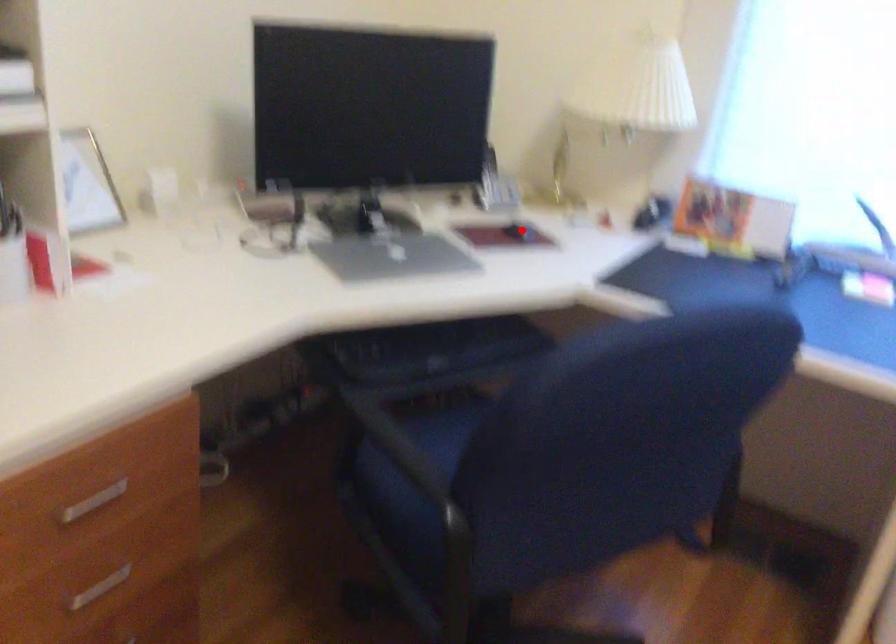
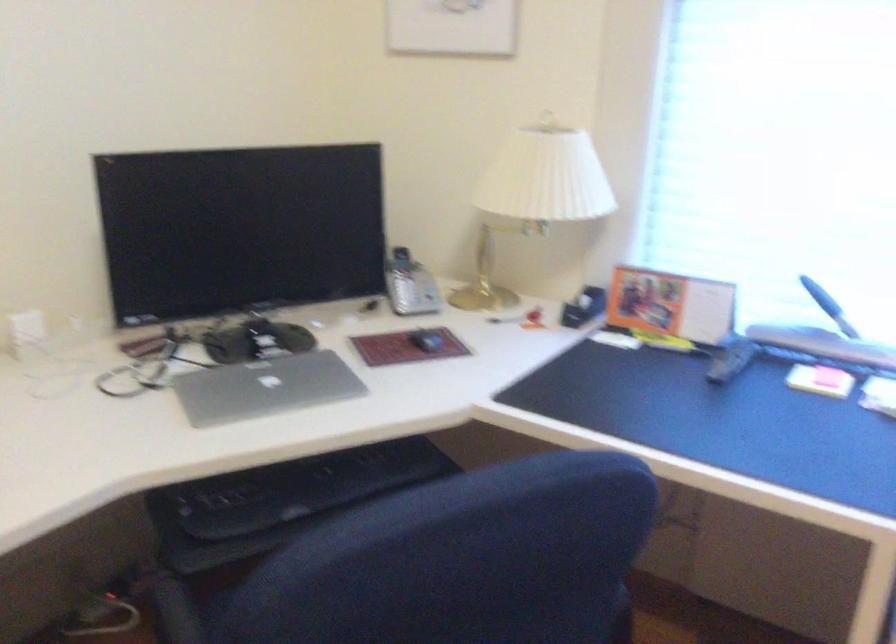
Question: I am providing you with two images of the same scene from different viewpoints. In image1, a red point is highlighted. Considering the same 3D point in image2, which of the following is correct?

Choices:
 (A) It is closer
 (B) It is farther

Answer: (A)